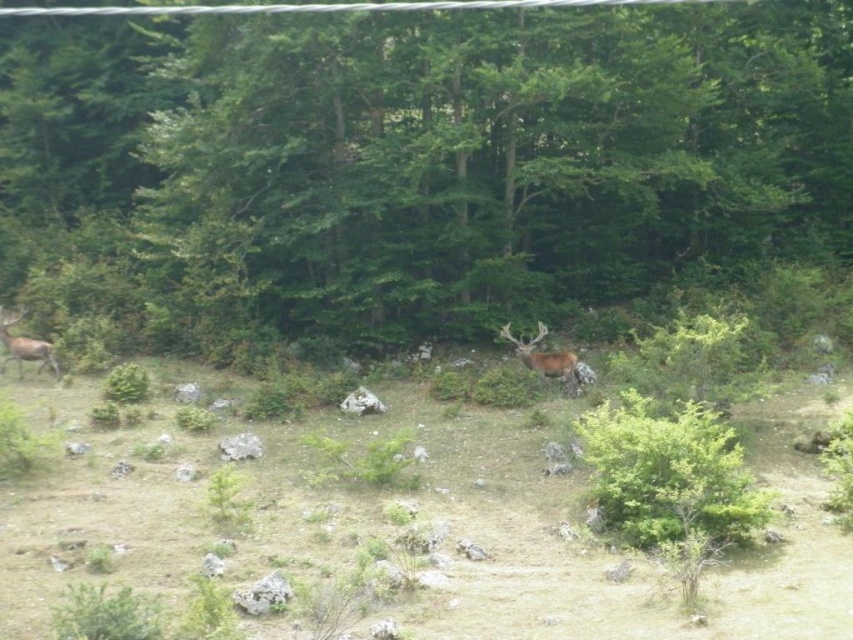
Is green leafy tree at center to the right of brown velvet deer at left from the viewer's perspective?

Correct, you'll find green leafy tree at center to the right of brown velvet deer at left.

Who is more forward, (752,125) or (9,336)?

Point (9,336) is in front.

What are the coordinates of `green leafy tree at center` in the screenshot? It's located at (412, 164).

Does brown velvet deer at center appear over brown velvet deer at left?

No.

You are a GUI agent. You are given a task and a screenshot of the screen. Output one action in this format:
    pyautogui.click(x=<x>, y=<y>)
    Task: Click on the brown velvet deer at center
    This screenshot has width=853, height=640.
    Given the screenshot: What is the action you would take?
    pyautogui.click(x=544, y=356)

You are a GUI agent. You are given a task and a screenshot of the screen. Output one action in this format:
    pyautogui.click(x=<x>, y=<y>)
    Task: Click on the brown velvet deer at center
    The image size is (853, 640).
    Given the screenshot: What is the action you would take?
    pyautogui.click(x=544, y=356)

Does green leafy tree at center lie behind brown velvet deer at center?

No, it is in front of brown velvet deer at center.

Looking at this image, can you confirm if green leafy tree at center is positioned below brown velvet deer at center?

Actually, green leafy tree at center is above brown velvet deer at center.

Between point (361, 61) and point (556, 372), which one is positioned behind?

The point (361, 61) is more distant.

Find the location of a particular element. The width and height of the screenshot is (853, 640). green leafy tree at center is located at coordinates (412, 164).